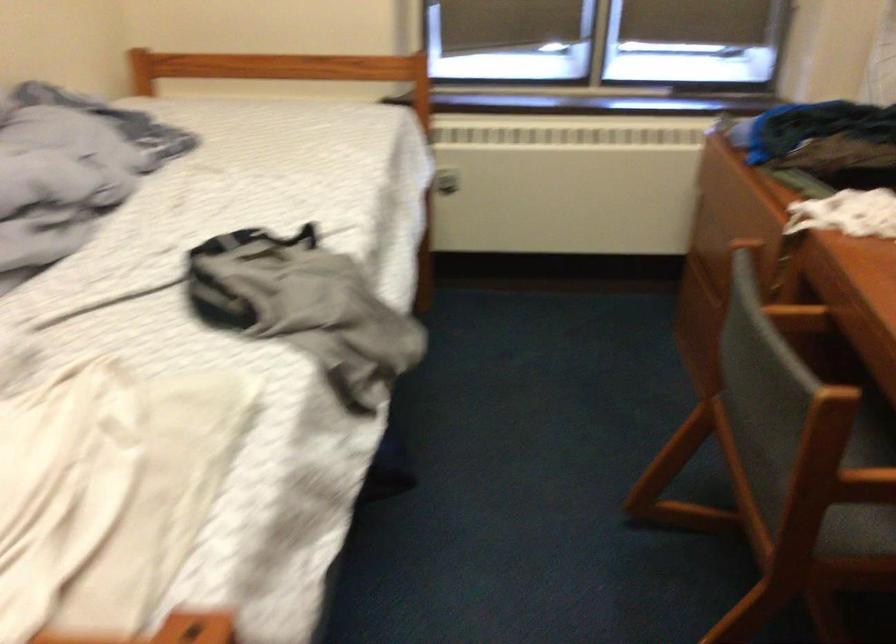
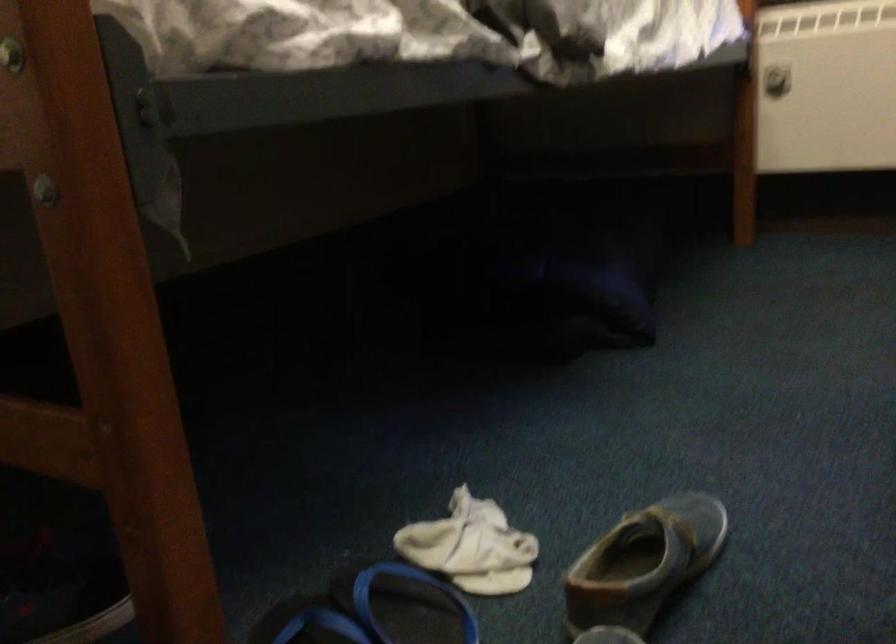
Where in the second image is the point corresponding to (x=458, y=185) from the first image?

(776, 80)